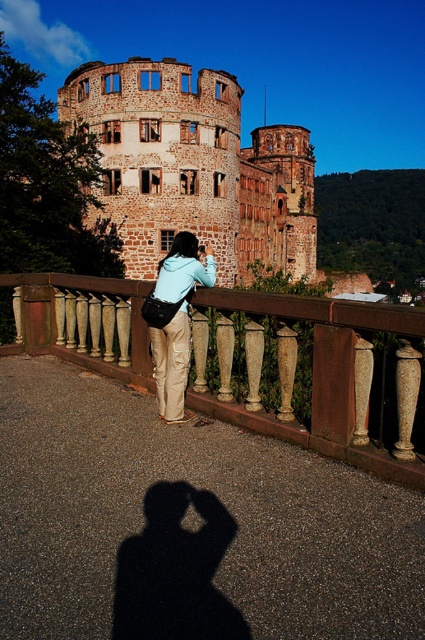
Question: Which object is closer to the camera taking this photo?

Choices:
 (A) brown wood railing at center
 (B) matte blue jacket at center

Answer: (A)

Question: Observing the image, what is the correct spatial positioning of brown wood railing at center in reference to matte blue jacket at center?

Choices:
 (A) right
 (B) left

Answer: (A)

Question: In this image, where is brown wood railing at center located relative to matte blue jacket at center?

Choices:
 (A) left
 (B) right

Answer: (B)

Question: Which point is farther to the camera?

Choices:
 (A) brown wood railing at center
 (B) matte blue jacket at center

Answer: (B)

Question: Where is brown wood railing at center located in relation to matte blue jacket at center in the image?

Choices:
 (A) above
 (B) below

Answer: (B)